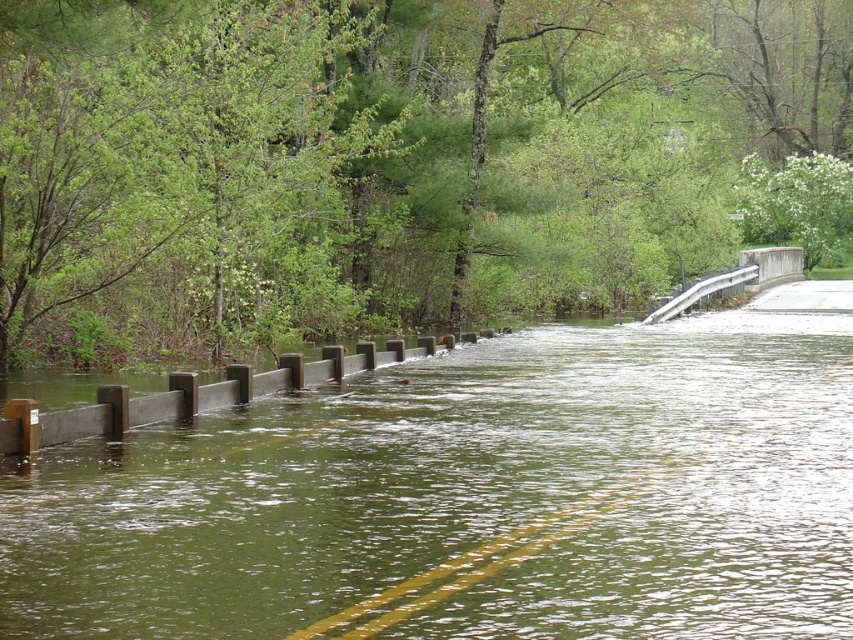
Between point (775, 445) and point (752, 170), which one is positioned in front?

Point (775, 445) is in front.

Who is taller, brown wooden barrier at center or white textured tree at upper center?

brown wooden barrier at center

The image size is (853, 640). What do you see at coordinates (469, 497) in the screenshot?
I see `brown wooden barrier at center` at bounding box center [469, 497].

The width and height of the screenshot is (853, 640). Find the location of `brown wooden barrier at center`. brown wooden barrier at center is located at coordinates (469, 497).

Between green leafy tree at upper center and white textured tree at upper center, which one is positioned higher?

white textured tree at upper center is higher up.

Is green leafy tree at upper center bigger than white textured tree at upper center?

Indeed, green leafy tree at upper center has a larger size compared to white textured tree at upper center.

Does point (349, 296) come behind point (805, 163)?

No, it is not.

Find the location of a particular element. The height and width of the screenshot is (640, 853). green leafy tree at upper center is located at coordinates (381, 161).

Is green leafy tree at upper center bigger than concrete/rough bridge at upper right?

Correct, green leafy tree at upper center is larger in size than concrete/rough bridge at upper right.

What do you see at coordinates (381, 161) in the screenshot? I see `green leafy tree at upper center` at bounding box center [381, 161].

Locate an element on the screen. Image resolution: width=853 pixels, height=640 pixels. green leafy tree at upper center is located at coordinates (381, 161).